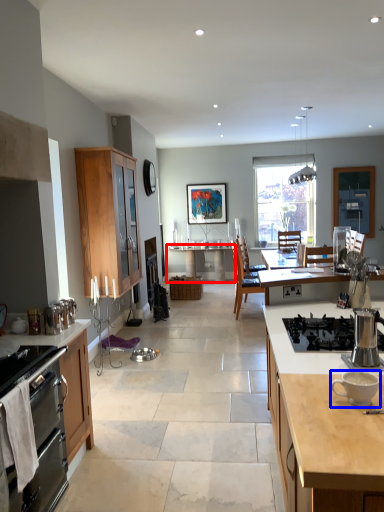
Question: Among these objects, which one is nearest to the camera, table (highlighted by a red box) or coffee cup (highlighted by a blue box)?

Choices:
 (A) table
 (B) coffee cup

Answer: (B)